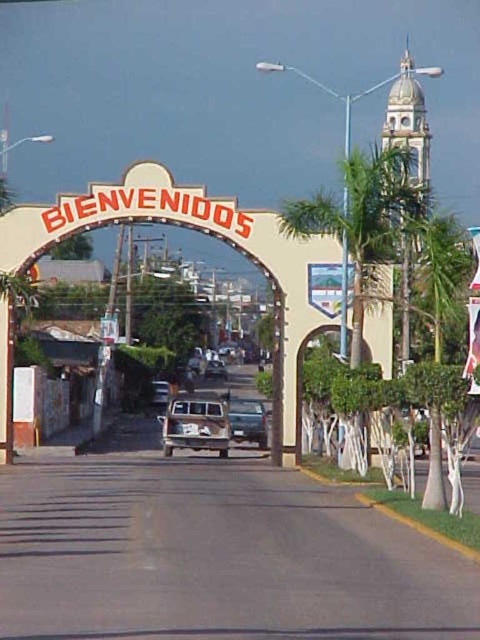
Is metallic silver car at center wider than matte black truck at center?

No, metallic silver car at center is not wider than matte black truck at center.

Looking at this image, does metallic silver car at center appear on the right side of matte black truck at center?

Correct, you'll find metallic silver car at center to the right of matte black truck at center.

Is point (262, 436) closer to camera compared to point (223, 371)?

That is True.

The height and width of the screenshot is (640, 480). I want to click on metallic silver car at center, so click(248, 420).

Does rusty metal van at center appear under matte black truck at center?

Yes.

Is point (162, 440) positioned in front of point (216, 369)?

Yes, it is.

Describe the element at coordinates (195, 424) in the screenshot. I see `rusty metal van at center` at that location.

Find the location of a particular element. This screenshot has width=480, height=640. rusty metal van at center is located at coordinates (195, 424).

Consider the image. How far apart are green leafy palm tree at right and metallic silver car at center?

green leafy palm tree at right is 22.81 meters away from metallic silver car at center.

Who is taller, green leafy palm tree at right or metallic silver car at center?

Standing taller between the two is green leafy palm tree at right.

I want to click on green leafy palm tree at right, so click(362, 220).